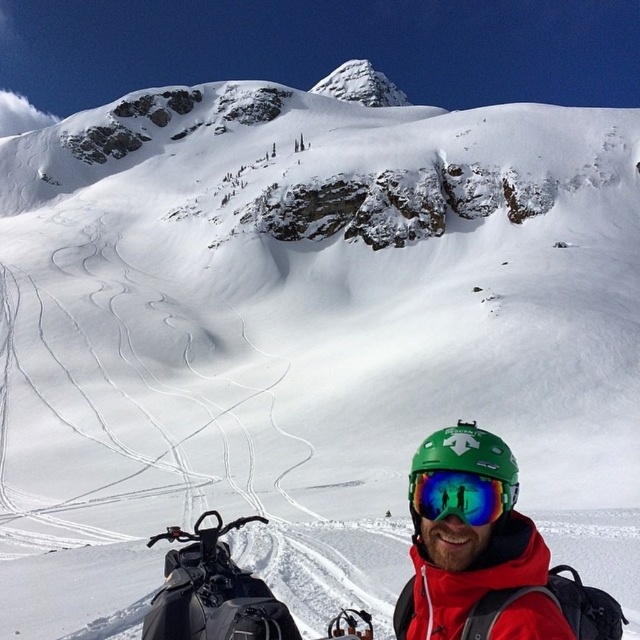
You are standing at the point marked as point (364, 616) in the image. You want to take a photo of the snowmobile at the bottom left corner. Is the snowmobile within your camera view if your camera has a 50mm focal length lens?

The distance between point (364, 616) and the camera is 43.30 meters. Since the snowmobile is located at the bottom left corner of the image, it would likely be within the camera view as the distance is not excessively large and the focal length of 50mm is standard for capturing such scenes.